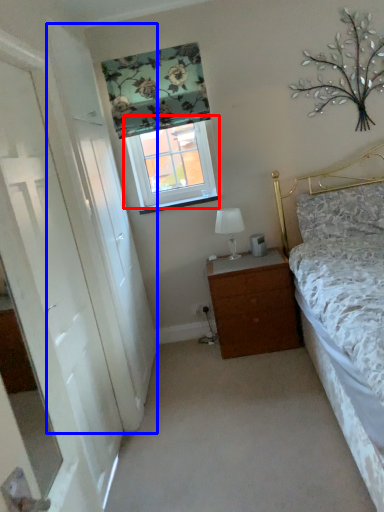
Question: Which point is closer to the camera, window (highlighted by a red box) or screen door (highlighted by a blue box)?

Choices:
 (A) window
 (B) screen door

Answer: (B)